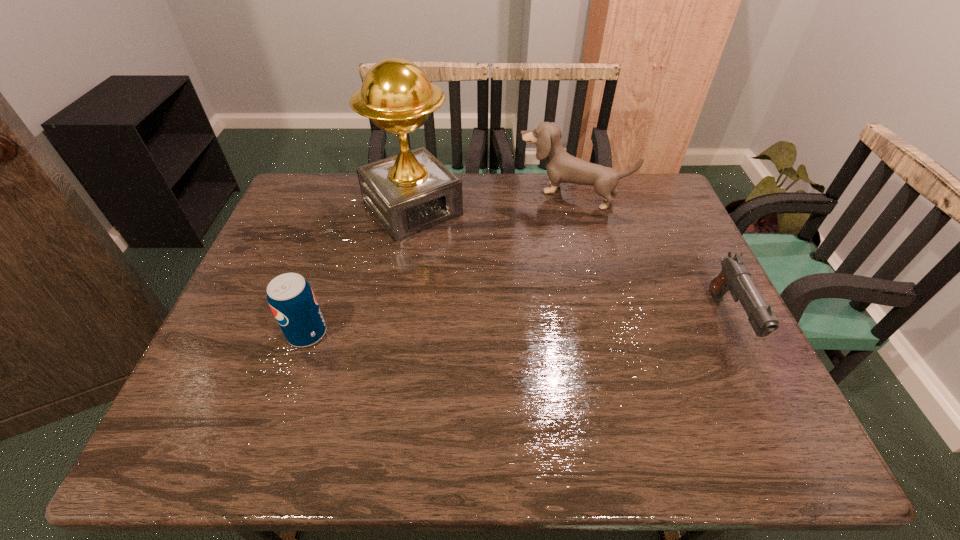
At what (x,y) coordinates should I click in order to perform the action: click on empty space that is in between the pop and the rightmost object. Please return your answer as a coordinate pair (x, y). The height and width of the screenshot is (540, 960). Looking at the image, I should click on (517, 327).

You are a GUI agent. You are given a task and a screenshot of the screen. Output one action in this format:
    pyautogui.click(x=<x>, y=<y>)
    Task: Click on the vacant region between the pop and the rightmost object
    This screenshot has height=540, width=960.
    Given the screenshot: What is the action you would take?
    pyautogui.click(x=517, y=327)

The height and width of the screenshot is (540, 960). Identify the location of free space between the puppy and the award. (492, 201).

Find the location of a particular element. The height and width of the screenshot is (540, 960). free space between the tallest object and the gun is located at coordinates (570, 264).

Find the location of `vacant area that lies between the award and the pop`. vacant area that lies between the award and the pop is located at coordinates (360, 271).

You are a GUI agent. You are given a task and a screenshot of the screen. Output one action in this format:
    pyautogui.click(x=<x>, y=<y>)
    Task: Click on the object identified as the closest to the tallest object
    
    Given the screenshot: What is the action you would take?
    pyautogui.click(x=561, y=167)

Locate which object is the third closest to the award. Please provide its 2D coordinates. Your answer should be formatted as a tuple, i.e. [(x, y)], where the tuple contains the x and y coordinates of a point satisfying the conditions above.

[(734, 276)]

Find the location of a particular element. free location that satisfies the following two spatial constraints: 1. on the back side of the puppy; 2. on the left side of the pop is located at coordinates (354, 193).